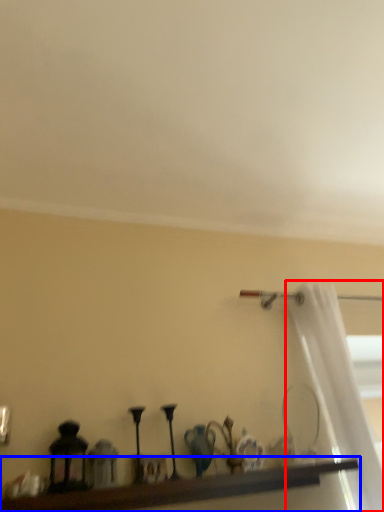
Question: Which object appears closest to the camera in this image, curtain (highlighted by a red box) or shelf (highlighted by a blue box)?

Choices:
 (A) curtain
 (B) shelf

Answer: (B)